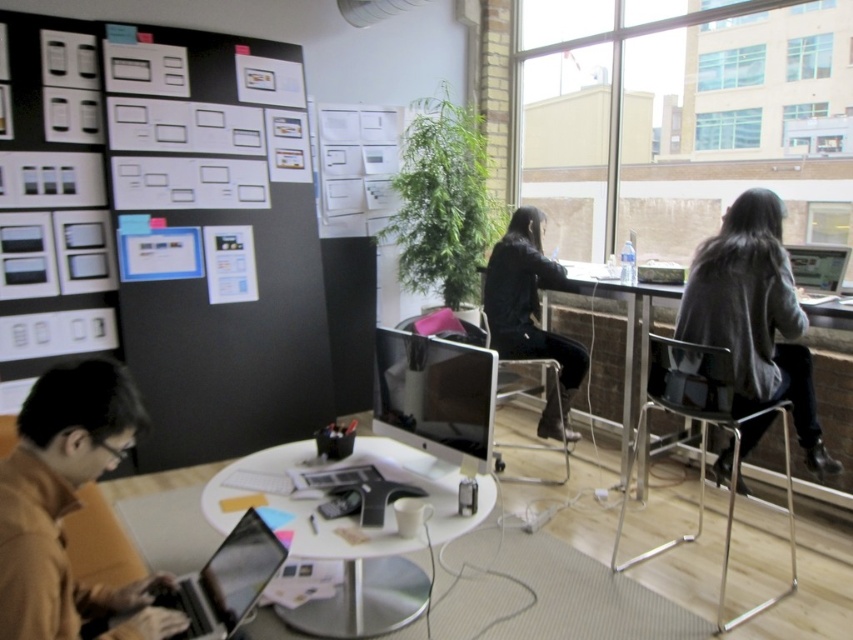
Question: Does satin black monitor at center appear under silver metallic laptop at lower left?

Choices:
 (A) no
 (B) yes

Answer: (A)

Question: Which of the following is the closest to the observer?

Choices:
 (A) clear plastic stool at lower center
 (B) silver metallic laptop at lower left
 (C) metallic silver stool at right

Answer: (B)

Question: Considering the relative positions of brown leather jacket at lower left and black matte jacket at center in the image provided, where is brown leather jacket at lower left located with respect to black matte jacket at center?

Choices:
 (A) above
 (B) below

Answer: (B)

Question: Which object is farther from the camera taking this photo?

Choices:
 (A) black matte jacket at center
 (B) gray sweater at right

Answer: (A)

Question: Is metallic silver stool at right wider than clear plastic stool at lower center?

Choices:
 (A) no
 (B) yes

Answer: (B)

Question: Estimate the real-world distances between objects in this image. Which object is closer to the black matte jacket at center?

Choices:
 (A) metallic silver stool at right
 (B) white glossy computer desk at center
 (C) satin black monitor at center
 (D) silver metallic laptop at lower left

Answer: (A)